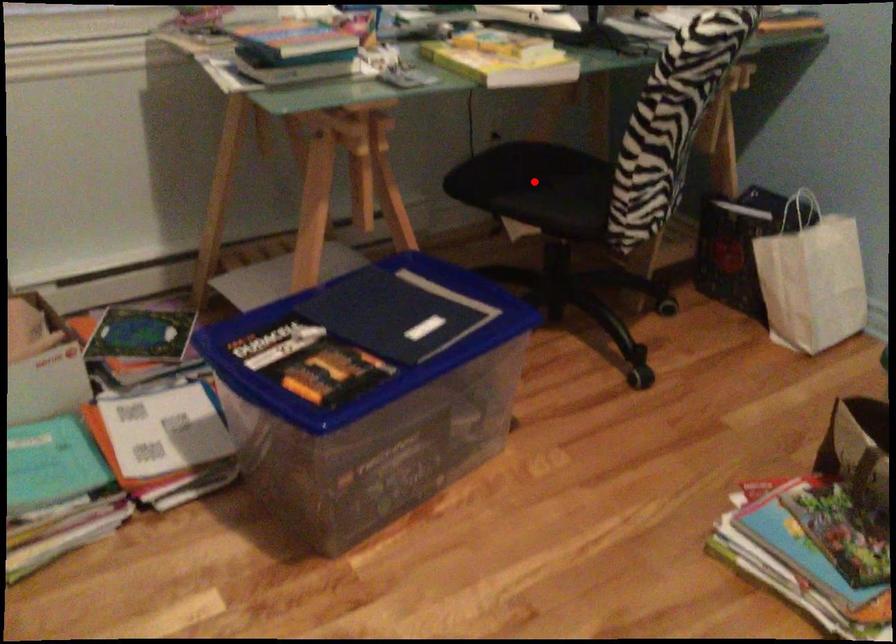
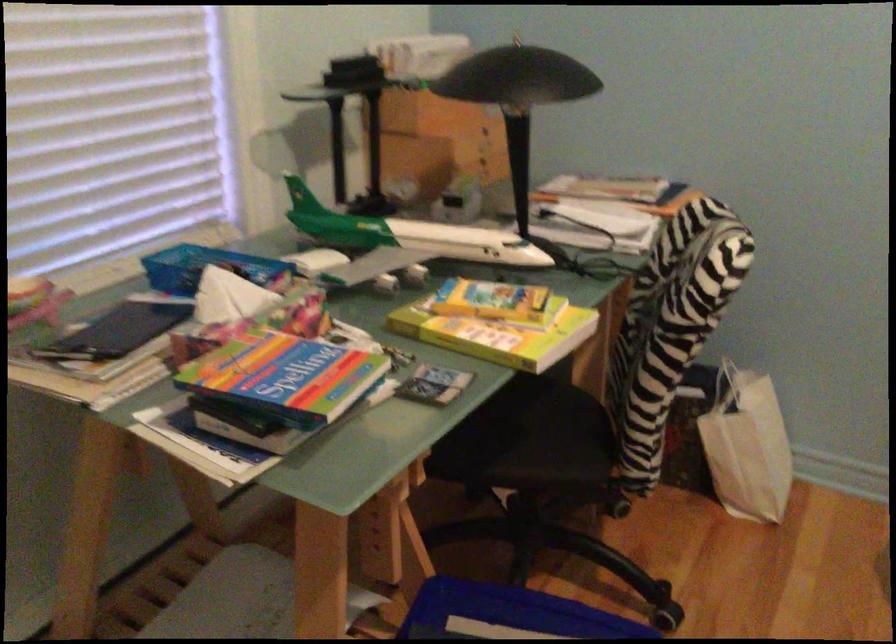
Locate, in the second image, the point that corresponds to the highlighted location in the first image.

(510, 430)